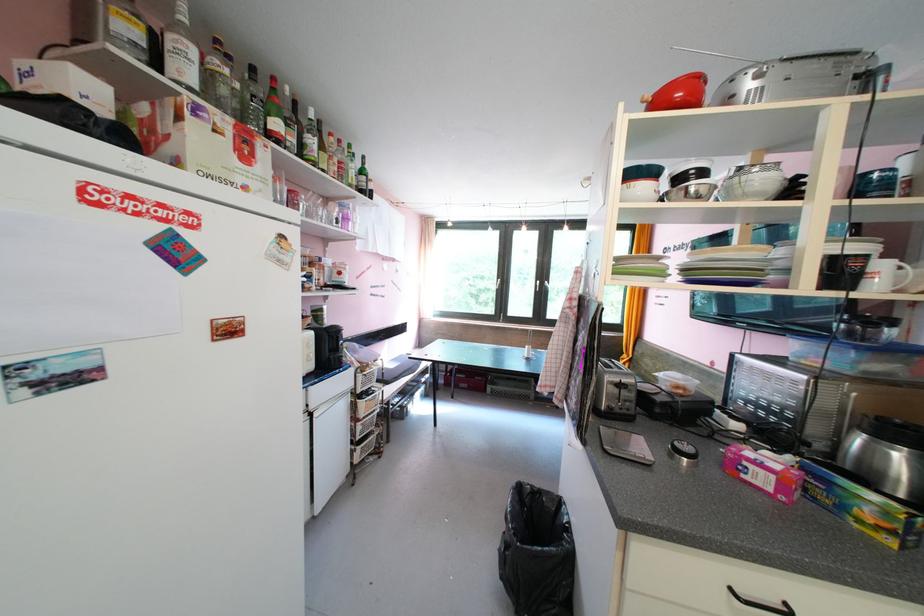
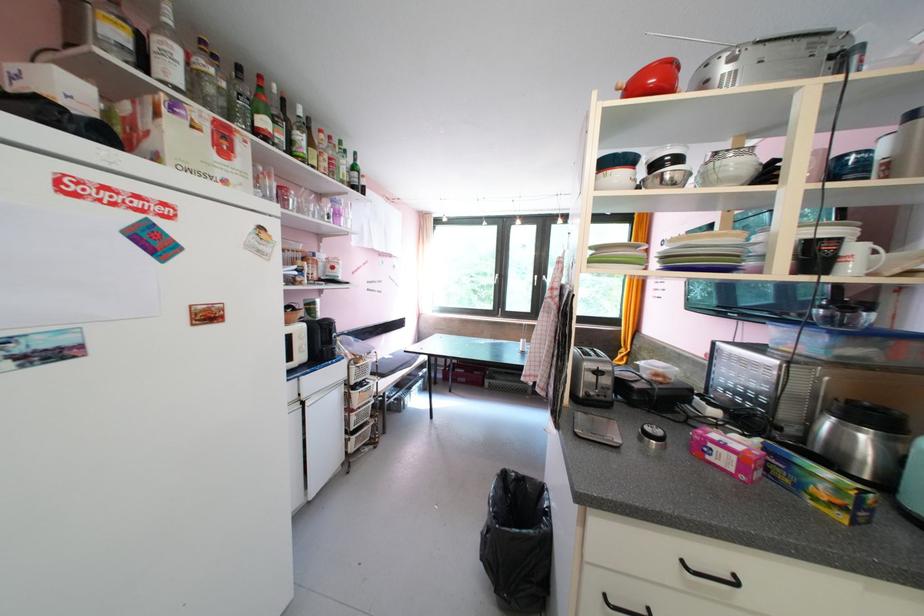
Find the pixel in the second image that matches point (246, 87) in the first image.

(233, 86)